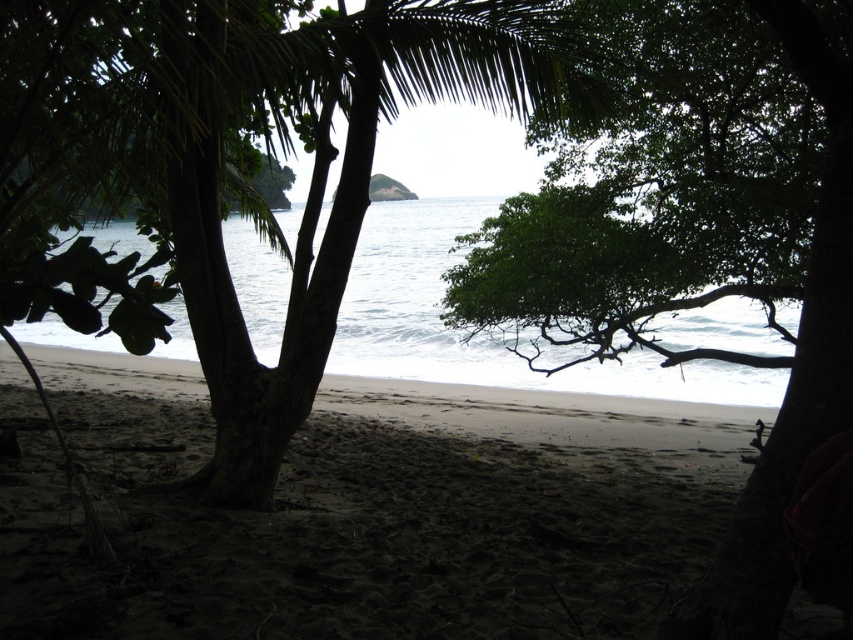
Does green leafy palm tree at center have a lesser height compared to green leafy tree at center?

Incorrect, green leafy palm tree at center's height does not fall short of green leafy tree at center's.

Does green leafy palm tree at center appear under green leafy tree at center?

Yes, green leafy palm tree at center is below green leafy tree at center.

Between point (312, 340) and point (825, 164), which one is positioned behind?

The point (312, 340) is behind.

Locate an element on the screen. Image resolution: width=853 pixels, height=640 pixels. green leafy palm tree at center is located at coordinates (x=228, y=168).

Who is higher up, green leafy tree at center or white smooth water at center?

Positioned higher is green leafy tree at center.

Where is `green leafy tree at center`? The image size is (853, 640). green leafy tree at center is located at coordinates (705, 236).

The image size is (853, 640). Describe the element at coordinates (228, 168) in the screenshot. I see `green leafy palm tree at center` at that location.

Can you confirm if green leafy palm tree at center is positioned below white smooth water at center?

No, green leafy palm tree at center is not below white smooth water at center.

Where is `green leafy palm tree at center`? green leafy palm tree at center is located at coordinates (228, 168).